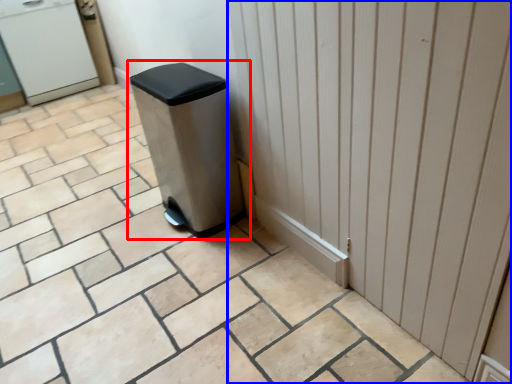
Question: Which of the following is the closest to the observer, waste container (highlighted by a red box) or door (highlighted by a blue box)?

Choices:
 (A) waste container
 (B) door

Answer: (B)